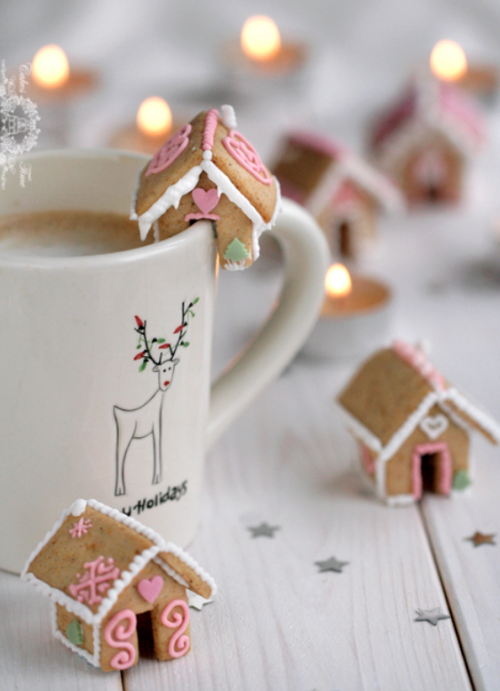
Where is `5 white frosting snow covered ceilings`? 5 white frosting snow covered ceilings is located at coordinates (181, 180), (142, 560), (418, 417), (354, 168), (412, 126).